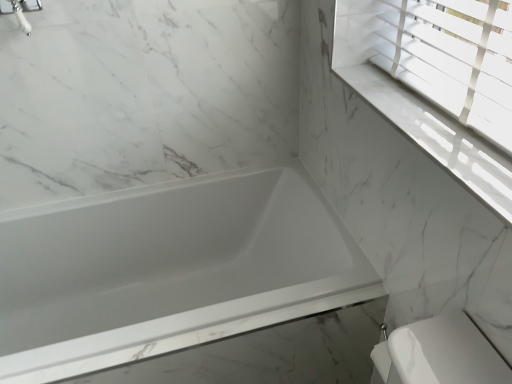
Question: From the image's perspective, relative to white glossy bathtub at center, is white marble window sill at upper right above or below?

Choices:
 (A) above
 (B) below

Answer: (A)

Question: Is white marble window sill at upper right situated inside white glossy bathtub at center or outside?

Choices:
 (A) outside
 (B) inside

Answer: (A)

Question: Considering the real-world distances, which object is farthest from the silver metallic faucet at upper left?

Choices:
 (A) white glossy bathtub at center
 (B) white marble window sill at upper right

Answer: (B)

Question: Which object is the closest to the white glossy bathtub at center?

Choices:
 (A) silver metallic faucet at upper left
 (B) white marble window sill at upper right

Answer: (B)